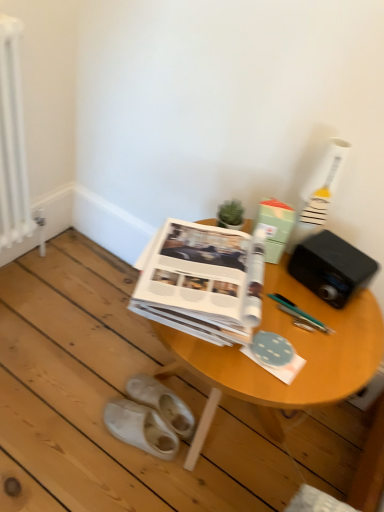
The height and width of the screenshot is (512, 384). What are the coordinates of `unoccupied region to the right of white paper at center, which appears as the second paperback book when viewed from the right` in the screenshot? It's located at (313, 339).